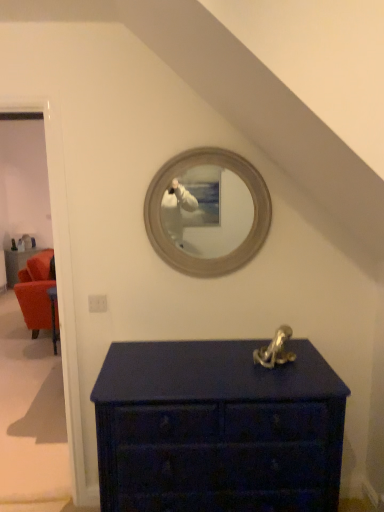
Question: In terms of size, does velvet orange armchair at left appear bigger or smaller than matte dark blue chest of drawers at lower center?

Choices:
 (A) small
 (B) big

Answer: (A)

Question: Considering the positions of velvet orange armchair at left and matte dark blue chest of drawers at lower center in the image, is velvet orange armchair at left taller or shorter than matte dark blue chest of drawers at lower center?

Choices:
 (A) tall
 (B) short

Answer: (B)

Question: Which is farther from the velvet orange armchair at left?

Choices:
 (A) matte white door at left
 (B) matte dark blue chest of drawers at lower center

Answer: (B)

Question: Estimate the real-world distances between objects in this image. Which object is farther from the matte white door at left?

Choices:
 (A) matte dark blue chest of drawers at lower center
 (B) velvet orange armchair at left

Answer: (B)